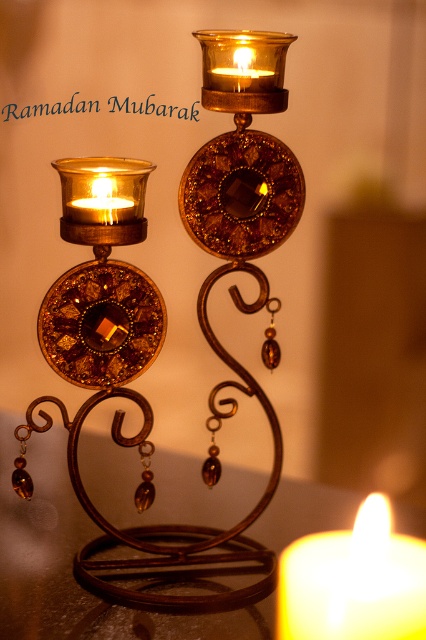
Looking at this image, is translucent wax candle at center bigger than matte gold candle at upper center?

Yes.

Who is taller, translucent wax candle at center or matte gold candle at upper center?

translucent wax candle at center is taller.

Does point (380, 528) come behind point (247, 45)?

No, (380, 528) is in front of (247, 45).

The image size is (426, 640). What are the coordinates of `translucent wax candle at center` in the screenshot? It's located at (353, 580).

Does gold metallic candle holder at center have a greater width compared to matte gold candle at left?

Indeed, gold metallic candle holder at center has a greater width compared to matte gold candle at left.

In the scene shown: Is gold metallic candle holder at center closer to camera compared to matte gold candle at left?

Yes.

Which is in front, point (216, 420) or point (127, 212)?

Point (127, 212) is in front.

Where is `gold metallic candle holder at center`? gold metallic candle holder at center is located at coordinates (203, 333).

Does metallic brown table at center appear on the left side of matte gold candle at left?

Incorrect, metallic brown table at center is not on the left side of matte gold candle at left.

Consider the image. Is metallic brown table at center taller than matte gold candle at left?

Correct, metallic brown table at center is much taller as matte gold candle at left.

Does point (146, 515) lie behind point (100, 193)?

Yes, it is behind point (100, 193).

Locate an element on the screen. The height and width of the screenshot is (640, 426). metallic brown table at center is located at coordinates (40, 541).